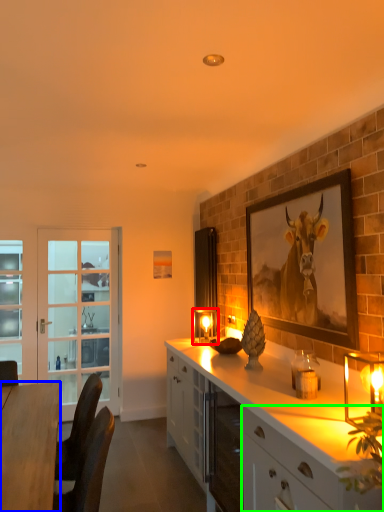
Question: Which object is positioned closest to candle holder (highlighted by a red box)? Select from desk (highlighted by a blue box) and cabinetry (highlighted by a green box).

Choices:
 (A) desk
 (B) cabinetry

Answer: (A)